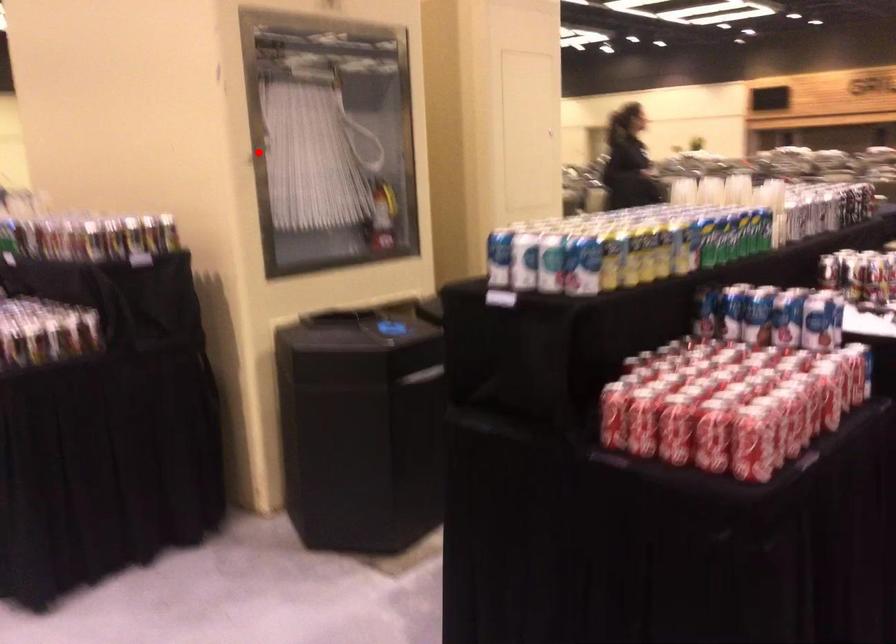
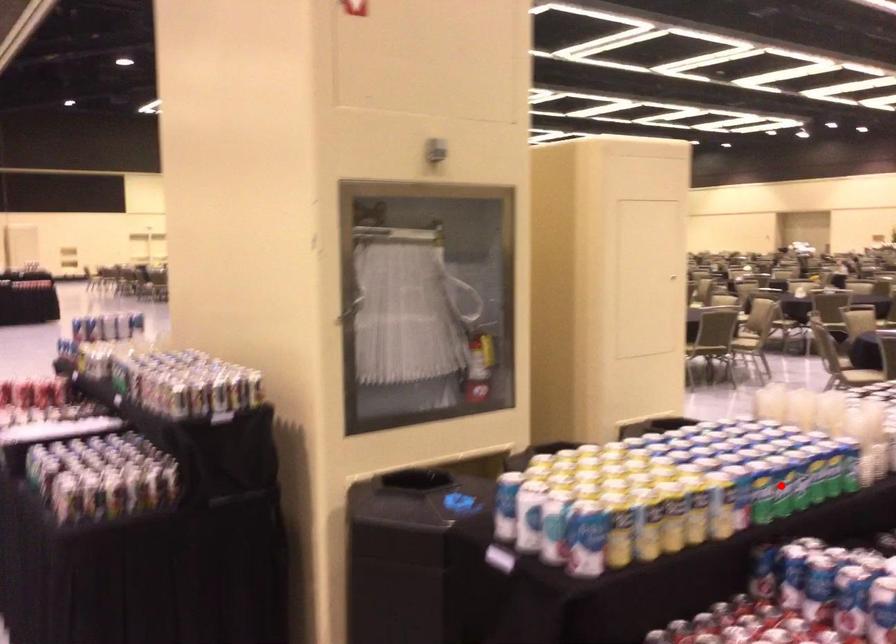
I am providing you with two images of the same scene from different viewpoints. A red point is marked on the first image and another point is marked on the second image. Do the highlighted points in image1 and image2 indicate the same real-world spot?

No